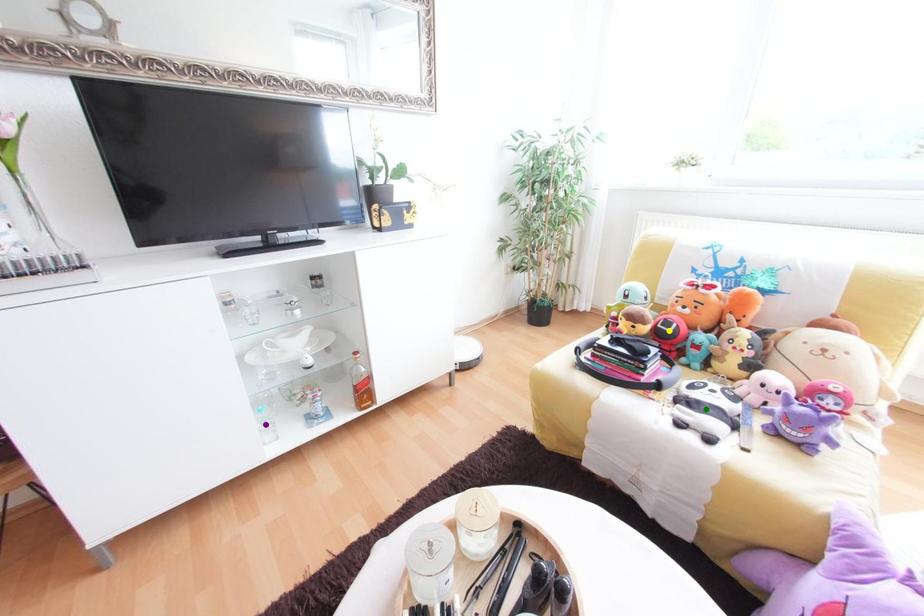
Order these from nearest to farthest:
A) purple point
B) yellow point
C) green point

green point < yellow point < purple point